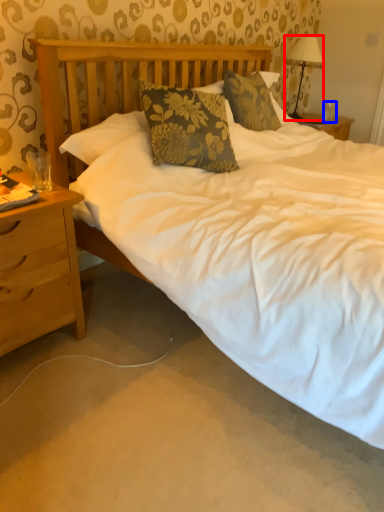
Question: Which object is closer to the camera taking this photo, lamp (highlighted by a red box) or coffee cup (highlighted by a blue box)?

Choices:
 (A) lamp
 (B) coffee cup

Answer: (A)